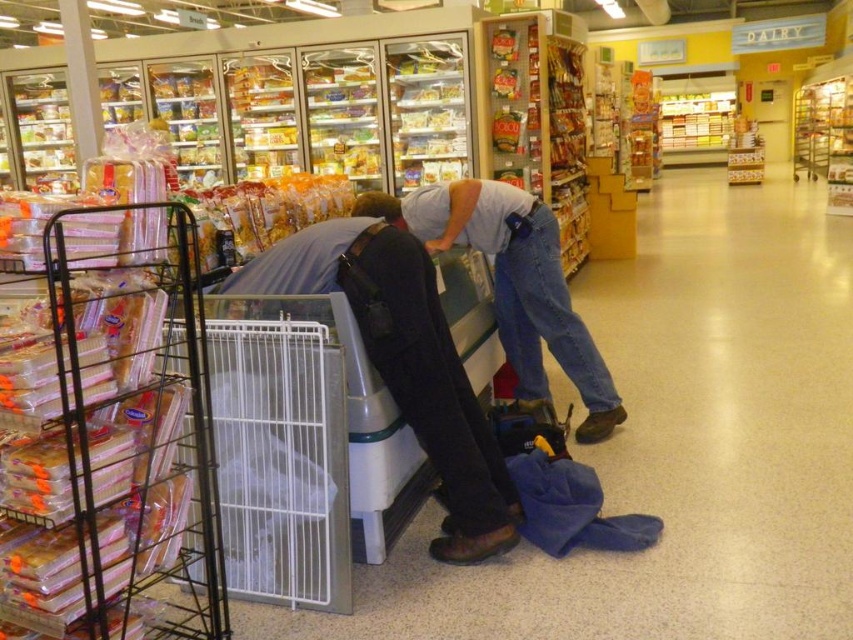
Question: Which point is closer to the camera?

Choices:
 (A) denim jeans at center
 (B) dark gray fabric at lower center

Answer: (B)

Question: Does dark gray fabric at lower center appear over denim jeans at center?

Choices:
 (A) yes
 (B) no

Answer: (B)

Question: Is the position of dark gray fabric at lower center more distant than that of denim jeans at center?

Choices:
 (A) yes
 (B) no

Answer: (B)

Question: Among these points, which one is farthest from the camera?

Choices:
 (A) (566, 316)
 (B) (263, 268)

Answer: (A)

Question: Is dark gray fabric at lower center to the left of denim jeans at center from the viewer's perspective?

Choices:
 (A) yes
 (B) no

Answer: (A)

Question: Among these points, which one is nearest to the camera?

Choices:
 (A) (376, 227)
 (B) (537, 228)

Answer: (A)